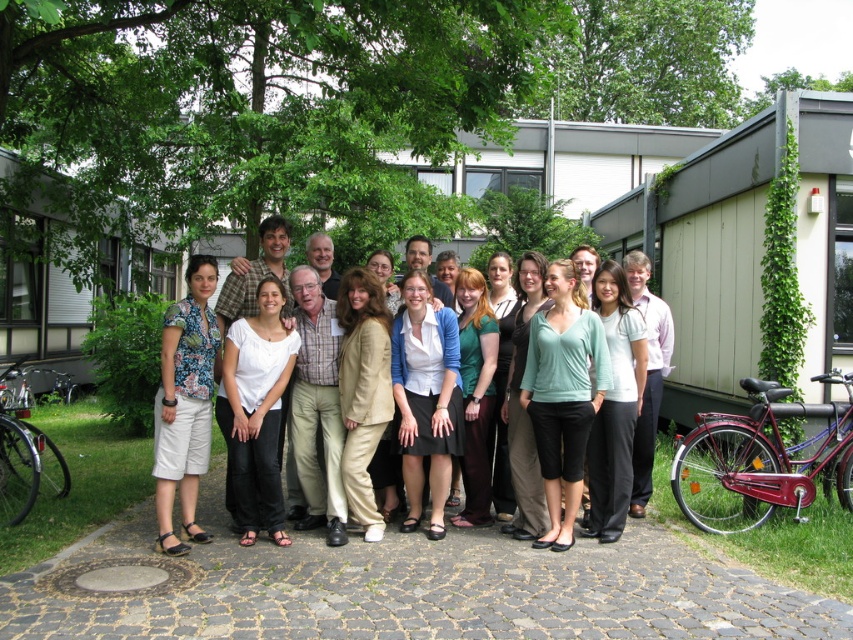
Question: Among these points, which one is farthest from the camera?

Choices:
 (A) (178, 413)
 (B) (294, 509)

Answer: (B)

Question: In this image, where is light beige suit at center located relative to floral print blouse at center?

Choices:
 (A) above
 (B) below

Answer: (A)

Question: Can you confirm if light beige suit at center is positioned below floral print blouse at center?

Choices:
 (A) no
 (B) yes

Answer: (A)

Question: Which object appears farthest from the camera in this image?

Choices:
 (A) floral print blouse at center
 (B) light beige suit at center

Answer: (B)

Question: Can you confirm if light beige suit at center is smaller than floral print blouse at center?

Choices:
 (A) no
 (B) yes

Answer: (B)